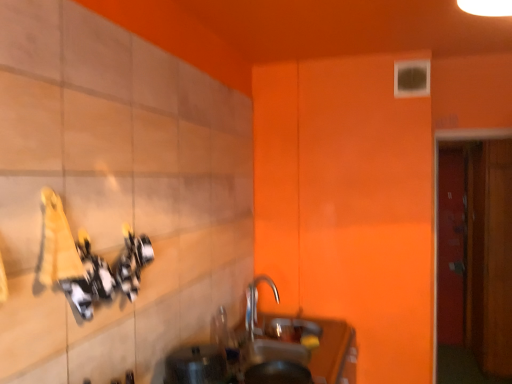
Question: Are metallic silver sink at lower center and silver metallic tap at center making contact?

Choices:
 (A) no
 (B) yes

Answer: (A)

Question: Can you confirm if metallic silver sink at lower center is smaller than silver metallic tap at center?

Choices:
 (A) yes
 (B) no

Answer: (A)

Question: Is metallic silver sink at lower center at the left side of silver metallic tap at center?

Choices:
 (A) yes
 (B) no

Answer: (A)

Question: Is there a large distance between metallic silver sink at lower center and silver metallic tap at center?

Choices:
 (A) no
 (B) yes

Answer: (A)

Question: Is metallic silver sink at lower center wider than silver metallic tap at center?

Choices:
 (A) no
 (B) yes

Answer: (A)

Question: Based on their sizes in the image, would you say silver metallic tap at center is bigger or smaller than wooden door at right, the second door from the front?

Choices:
 (A) big
 (B) small

Answer: (B)

Question: Considering their positions, is silver metallic tap at center located in front of or behind wooden door at right, acting as the 1th door starting from the right?

Choices:
 (A) behind
 (B) front

Answer: (B)

Question: In the image, is silver metallic tap at center on the left side or the right side of wooden door at right, the 1th door viewed from the back?

Choices:
 (A) left
 (B) right

Answer: (A)

Question: Is silver metallic tap at center wider or thinner than wooden door at right, which is counted as the 2th door, starting from the left?

Choices:
 (A) thin
 (B) wide

Answer: (B)

Question: From the image's perspective, is metallic silver sink at lower center located above or below wooden door at right, which is counted as the 2th door, starting from the left?

Choices:
 (A) below
 (B) above

Answer: (A)

Question: Considering their positions, is metallic silver sink at lower center located in front of or behind wooden door at right, acting as the 1th door starting from the right?

Choices:
 (A) front
 (B) behind

Answer: (A)

Question: Based on their sizes in the image, would you say metallic silver sink at lower center is bigger or smaller than wooden door at right, acting as the 1th door starting from the right?

Choices:
 (A) big
 (B) small

Answer: (B)

Question: From a real-world perspective, is metallic silver sink at lower center positioned above or below wooden door at right, the second door from the front?

Choices:
 (A) above
 (B) below

Answer: (A)

Question: From the image's perspective, is metallic silver sink at lower center positioned above or below silver metallic tap at center?

Choices:
 (A) below
 (B) above

Answer: (A)

Question: Is metallic silver sink at lower center wider or thinner than silver metallic tap at center?

Choices:
 (A) thin
 (B) wide

Answer: (A)